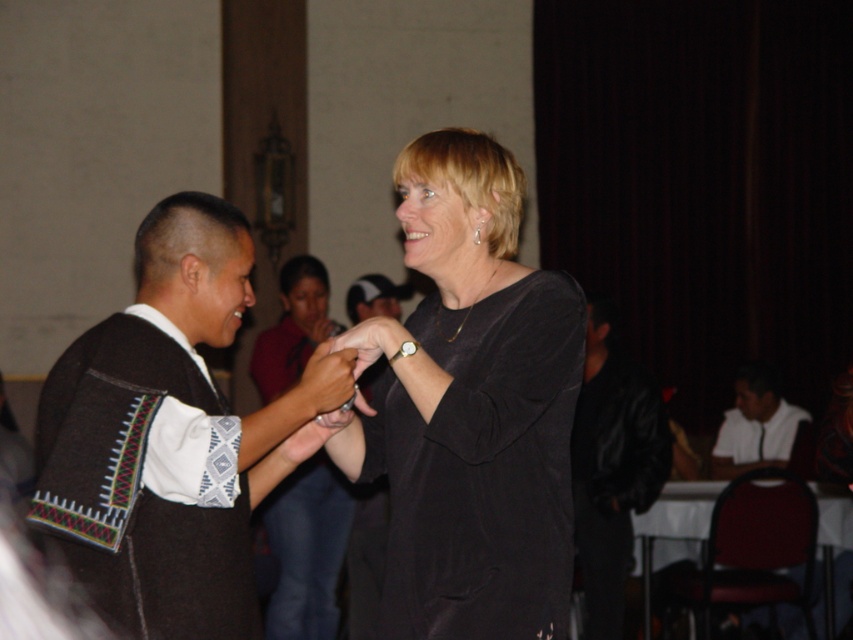
Question: Which point appears farthest from the camera in this image?

Choices:
 (A) (323, 369)
 (B) (337, 492)
 (C) (737, 429)

Answer: (C)

Question: Does black leather jacket at right appear over matte black dress at center?

Choices:
 (A) no
 (B) yes

Answer: (B)

Question: Which point is farther from the camera taking this photo?

Choices:
 (A) (74, 401)
 (B) (332, 529)
 (C) (610, 634)
 (D) (750, 390)

Answer: (D)

Question: Is the position of black matte dress at center less distant than that of matte black hand at center?

Choices:
 (A) yes
 (B) no

Answer: (A)

Question: Among these points, which one is nearest to the camera?

Choices:
 (A) (633, 436)
 (B) (125, 337)
 (C) (339, 400)

Answer: (B)

Question: Does knitted wool sweater at left have a smaller size compared to white glossy shirt at lower right?

Choices:
 (A) no
 (B) yes

Answer: (B)